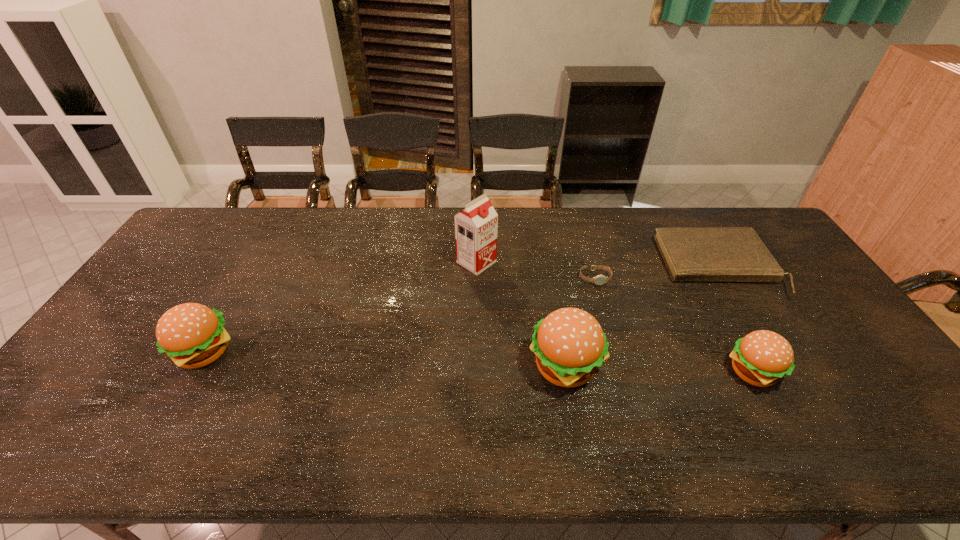
Please determine a free point for an extra hamburger to ensure balance. Please provide its 2D coordinates. Your answer should be formatted as a tuple, i.e. [(x, y)], where the tuple contains the x and y coordinates of a point satisfying the conditions above.

[(383, 359)]